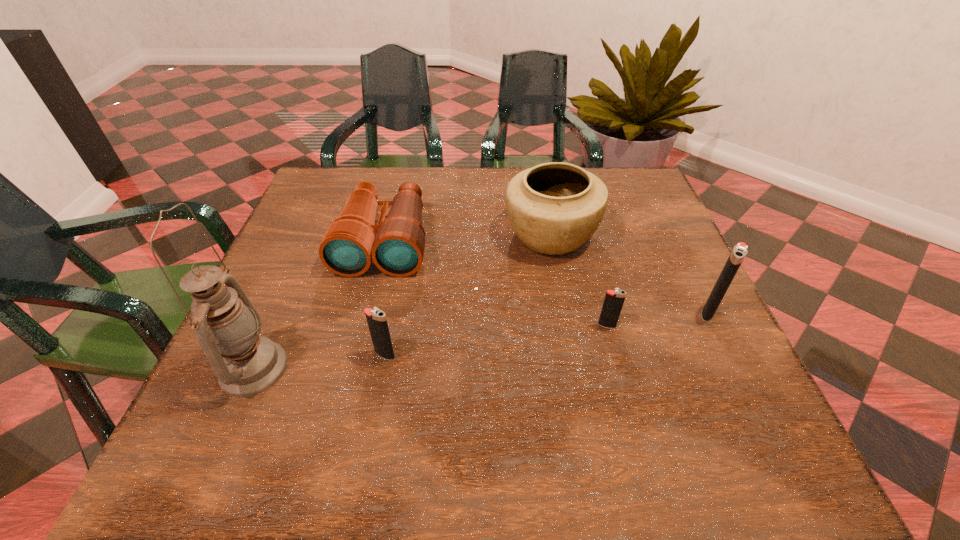
This screenshot has width=960, height=540. I want to click on the nearest igniter, so click(376, 318).

The width and height of the screenshot is (960, 540). What are the coordinates of `the second shortest igniter` in the screenshot? It's located at (376, 318).

You are a GUI agent. You are given a task and a screenshot of the screen. Output one action in this format:
    pyautogui.click(x=<x>, y=<y>)
    Task: Click on the shortest object
    The image size is (960, 540).
    Given the screenshot: What is the action you would take?
    pyautogui.click(x=614, y=300)

You are a GUI agent. You are given a task and a screenshot of the screen. Output one action in this format:
    pyautogui.click(x=<x>, y=<y>)
    Task: Click on the second igniter from right to left
    The width and height of the screenshot is (960, 540).
    Given the screenshot: What is the action you would take?
    pyautogui.click(x=614, y=300)

Identify the location of the rightmost igniter. (739, 251).

In order to click on the tallest igniter in this screenshot , I will do 739,251.

The height and width of the screenshot is (540, 960). I want to click on binoculars, so click(396, 245).

Locate an element on the screen. This screenshot has width=960, height=540. pottery is located at coordinates (554, 208).

I want to click on the tallest object, so click(227, 326).

At what (x,y) coordinates should I click in order to perform the action: click on oil lamp. Please return your answer as a coordinate pair (x, y). This screenshot has width=960, height=540. Looking at the image, I should click on (227, 326).